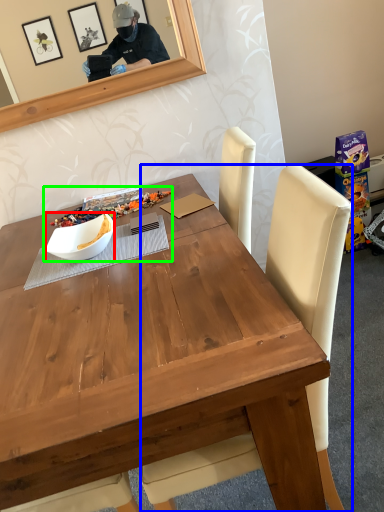
Question: Considering the real-world distances, which object is closest to bowl (highlighted by a red box)? chair (highlighted by a blue box) or fruit dish (highlighted by a green box).

Choices:
 (A) chair
 (B) fruit dish

Answer: (B)